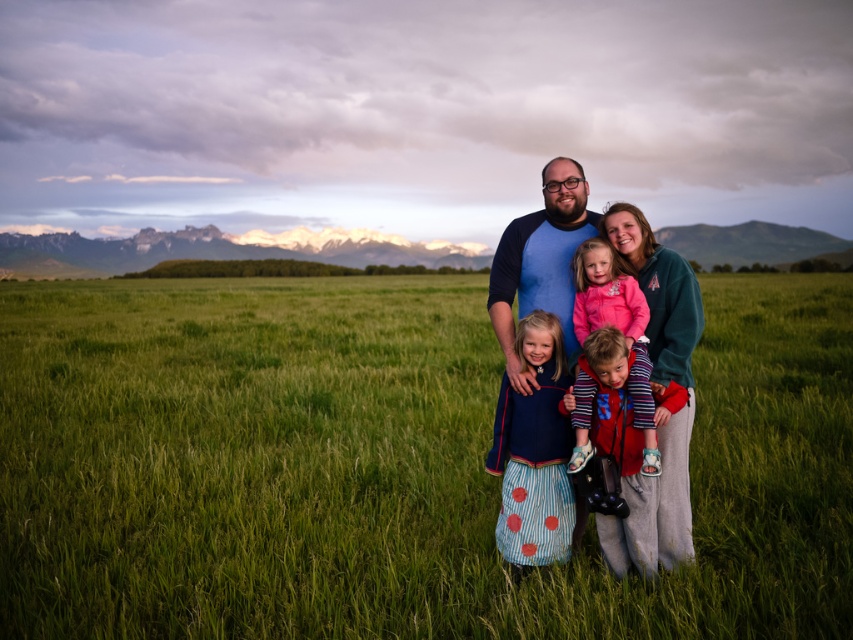
You are a photographer trying to capture the family in the image. Since the green grassy field at center and the blue jersey at center are both in the scene, which one is taller?

The green grassy field at center is much taller than the blue jersey at center, so the green grassy field at center is taller.

You are a photographer trying to capture a family photo. You notice two blue items in the center of the image. One is the blue cotton shirt at center, and the other is the blue polka dot dress at center. From the photographer standing behind the camera, which blue item is positioned to the right?

The blue cotton shirt at center is to the right of the blue polka dot dress at center.